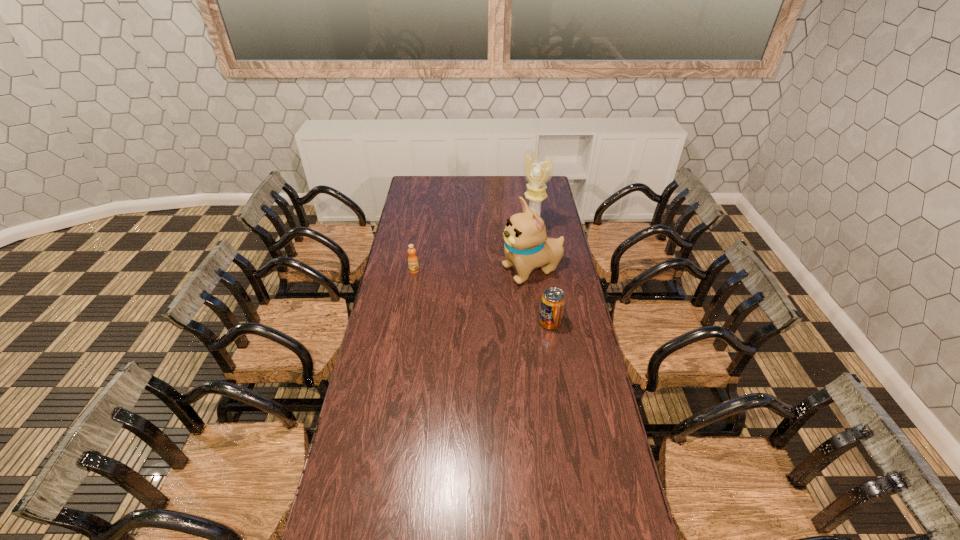
At what (x,y) coordinates should I click in order to perform the action: click on the leftmost object. Please return your answer as a coordinate pair (x, y). Looking at the image, I should click on (413, 264).

Identify the location of the nearest object. This screenshot has height=540, width=960. (553, 300).

This screenshot has height=540, width=960. I want to click on award, so click(538, 172).

This screenshot has height=540, width=960. Find the location of `puppy`. puppy is located at coordinates (526, 247).

Identify the location of free space located 0.170m on the front label of the orange juice. The height and width of the screenshot is (540, 960). (409, 298).

Locate an element on the screen. This screenshot has width=960, height=540. free spot located on the left of the nearest object is located at coordinates (449, 322).

I want to click on free point located 0.400m on the front-facing side of the farthest object, so click(478, 273).

Find the location of a particular element. This screenshot has width=960, height=540. vacant space located on the front-facing side of the farthest object is located at coordinates (504, 253).

Locate an element on the screen. Image resolution: width=960 pixels, height=540 pixels. free point located on the front-facing side of the farthest object is located at coordinates (516, 242).

Locate an element on the screen. free space located on the face of the puppy is located at coordinates (491, 281).